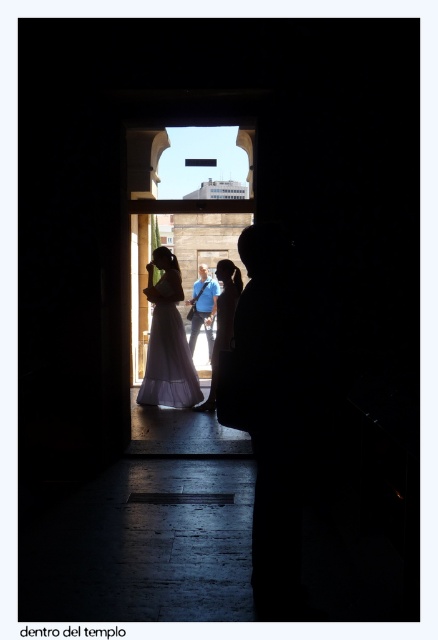
Is white tulle dress at center closer to the viewer compared to white satin dress at center?

No, it is not.

Who is shorter, white tulle dress at center or white satin dress at center?

With less height is white tulle dress at center.

You are a GUI agent. You are given a task and a screenshot of the screen. Output one action in this format:
    pyautogui.click(x=<x>, y=<y>)
    Task: Click on the white tulle dress at center
    The image size is (438, 640).
    Given the screenshot: What is the action you would take?
    pyautogui.click(x=169, y=364)

Which is above, white satin dress at center or blue fabric shirt at center?

Positioned higher is blue fabric shirt at center.

Consider the image. Can you confirm if white satin dress at center is taller than blue fabric shirt at center?

Yes.

Measure the distance between white satin dress at center and camera.

They are 21.79 feet apart.

Where is `white satin dress at center`? The image size is (438, 640). white satin dress at center is located at coordinates (222, 323).

Can you confirm if white tulle dress at center is wider than blue fabric shirt at center?

Yes, white tulle dress at center is wider than blue fabric shirt at center.

Consider the image. Does white tulle dress at center have a larger size compared to blue fabric shirt at center?

No, white tulle dress at center is not bigger than blue fabric shirt at center.

Find the location of a particular element. Image resolution: width=438 pixels, height=640 pixels. white tulle dress at center is located at coordinates (169, 364).

This screenshot has height=640, width=438. What are the coordinates of `white tulle dress at center` in the screenshot? It's located at (169, 364).